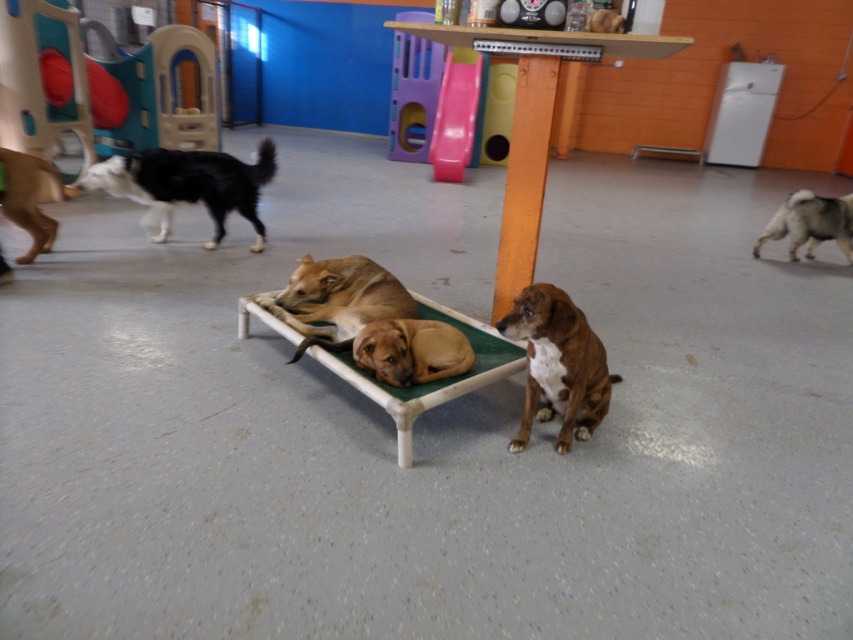
You are standing in a dog daycare and want to pet the black and white fur at upper left. If you can reach 2 meters, can you touch it from where you are?

The black and white fur at upper left and viewer are 3.35 meters apart, so you cannot reach it since your reach is only 2 meters.